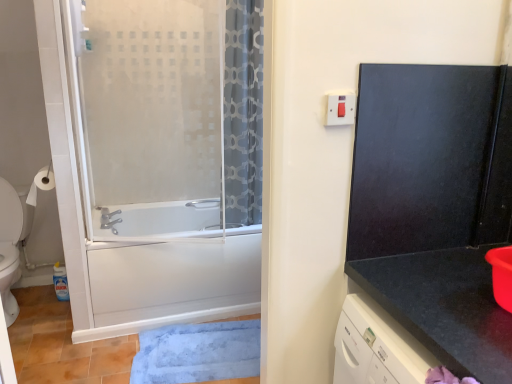
Question: From a real-world perspective, is white plastic switch at upper right physically located above or below frosted glass screen door at left, arranged as the first screen door when viewed from the left?

Choices:
 (A) above
 (B) below

Answer: (A)

Question: Considering the positions of white plastic switch at upper right and frosted glass screen door at left, which is the 2th screen door in right-to-left order, in the image, is white plastic switch at upper right wider or thinner than frosted glass screen door at left, which is the 2th screen door in right-to-left order,?

Choices:
 (A) wide
 (B) thin

Answer: (B)

Question: Which is nearer to the white matte toilet paper at left?

Choices:
 (A) black granite countertop at right
 (B) frosted glass screen door at left, which is the 2th screen door in right-to-left order
 (C) white plastic switch at upper right
 (D) blue plush bath mat at lower center
 (E) white glossy toilet at left

Answer: (E)

Question: Which object is positioned closest to the black matte screen door at upper right, acting as the second screen door starting from the left?

Choices:
 (A) black granite countertop at right
 (B) white plastic switch at upper right
 (C) frosted glass screen door at left, arranged as the first screen door when viewed from the left
 (D) white glossy toilet at left
 (E) white matte toilet paper at left

Answer: (A)